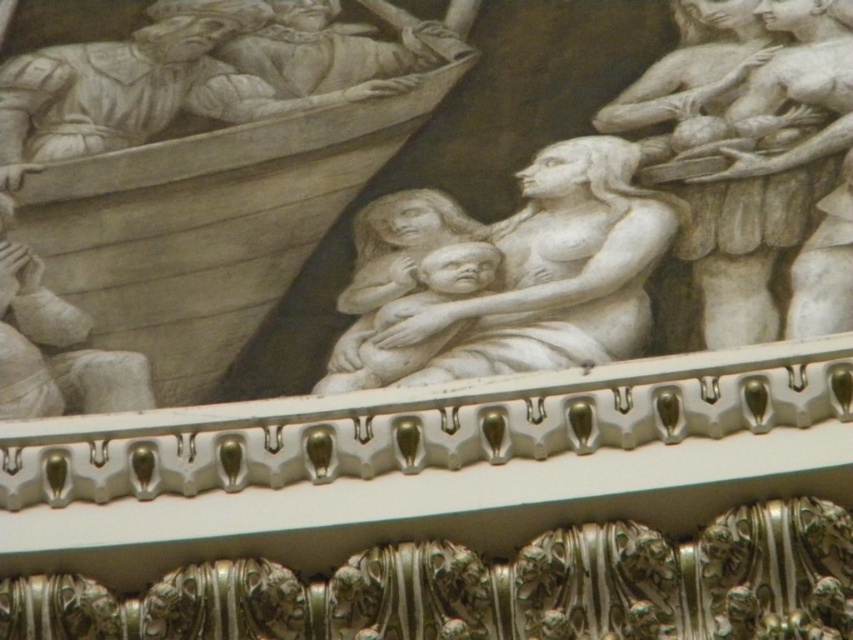
From the picture: You are an art conservator examining the sculptural relief. You notice the wooden boat at center and the matte gray stone boat at left. Which boat is placed above the other?

The wooden boat at center is positioned over the matte gray stone boat at left.

You are an art conservator examining the sculptural relief. You need to determine if the white marble boat at upper left can fit through an opening that is the same width as the matte gray stone boat at left. Can it fit?

The white marble boat at upper left might be wider than matte gray stone boat at left, so it may not fit through the opening if it is indeed wider.